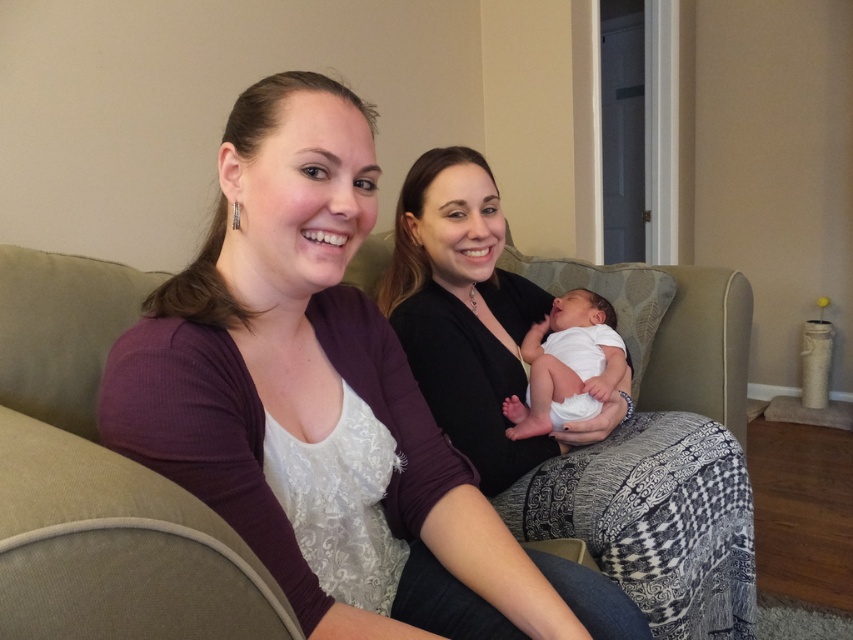
Is purple ribbed cardigan at left to the right of white clothed newborn at center from the viewer's perspective?

Incorrect, purple ribbed cardigan at left is not on the right side of white clothed newborn at center.

Between point (318, 548) and point (558, 413), which one is positioned in front?

Point (318, 548) is more forward.

Measure the distance between purple ribbed cardigan at left and camera.

A distance of 25.85 inches exists between purple ribbed cardigan at left and camera.

This screenshot has width=853, height=640. I want to click on purple ribbed cardigan at left, so click(x=323, y=404).

Between purple ribbed cardigan at left and matte black shirt at center, which one is positioned higher?

purple ribbed cardigan at left

Is purple ribbed cardigan at left positioned in front of matte black shirt at center?

That is True.

Locate an element on the screen. The image size is (853, 640). purple ribbed cardigan at left is located at coordinates (323, 404).

Does matte black shirt at center have a smaller size compared to white clothed newborn at center?

Incorrect, matte black shirt at center is not smaller in size than white clothed newborn at center.

Describe the element at coordinates (567, 426) in the screenshot. The width and height of the screenshot is (853, 640). I see `matte black shirt at center` at that location.

Where is `matte black shirt at center`? This screenshot has height=640, width=853. matte black shirt at center is located at coordinates 567,426.